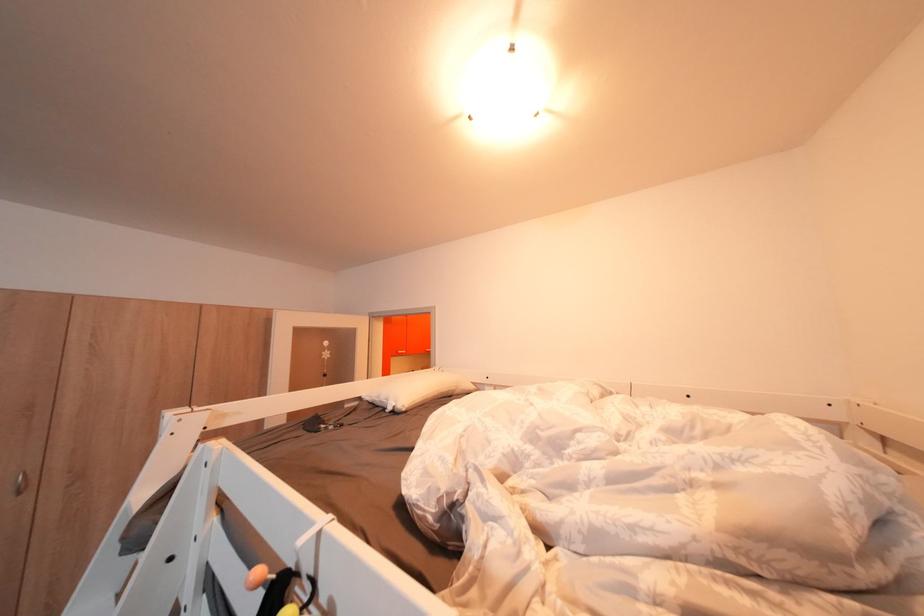
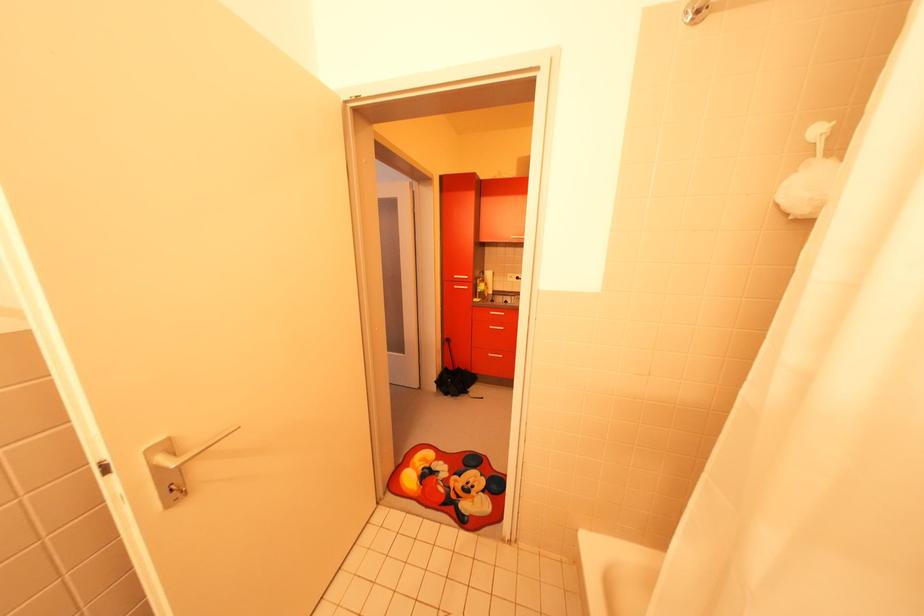
Question: I am providing you with two images of the same scene from different viewpoints. Please identify which objects are invisible in image2.

Choices:
 (A) white bed rail
 (B) silver cabinet handle
 (C) toy maze bead
 (D) silver drawer handle

Answer: (A)